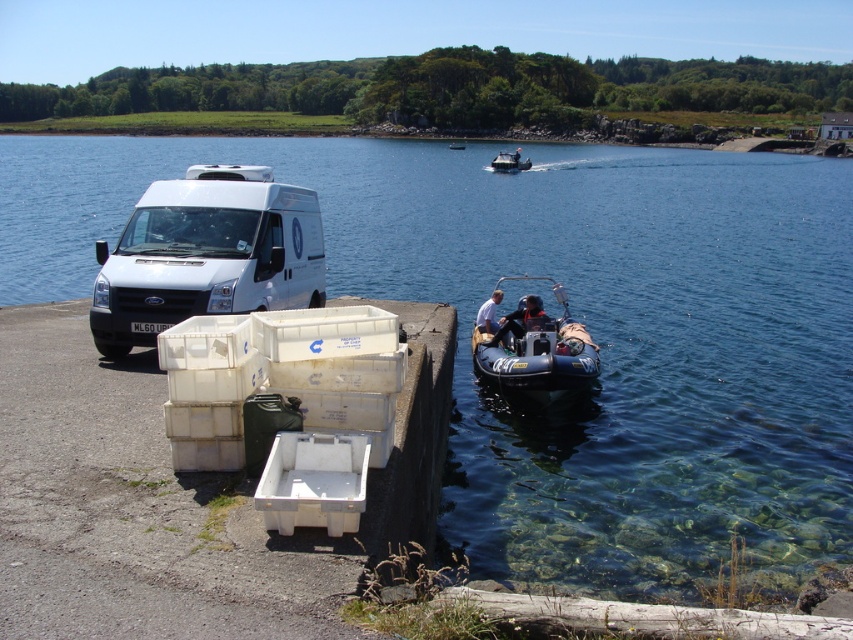
You are a delivery driver who needs to unload a package from the white matte van at left and place it into the blue rubber boat at center. Based on their positions, which direction should you move the package from the van to reach the boat?

The white matte van at left is to the left of the blue rubber boat at center, so you should move the package to the right to place it into the boat.

You are a delivery driver who needs to load a package onto the white matte van at left. The blue rubber boat at center is blocking the van door. Can you move the boat to the side to access the van?

The white matte van at left is larger in size than the blue rubber boat at center, so yes, you can move the blue rubber boat at center to the side to access the van door since it is smaller and less obstructive.